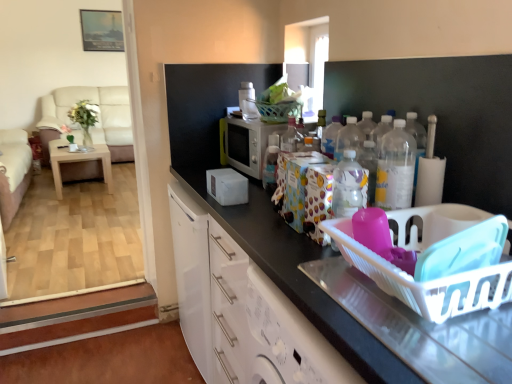
Question: Considering the relative sizes of beige fabric couch at left, the second couch positioned from the front, and white plastic basket at right in the image provided, is beige fabric couch at left, the second couch positioned from the front, shorter than white plastic basket at right?

Choices:
 (A) yes
 (B) no

Answer: (B)

Question: From a real-world perspective, does beige fabric couch at left, arranged as the first couch when viewed from the back, sit lower than white plastic basket at right?

Choices:
 (A) no
 (B) yes

Answer: (B)

Question: Are beige fabric couch at left, arranged as the first couch when viewed from the back, and white plastic basket at right located far from each other?

Choices:
 (A) no
 (B) yes

Answer: (B)

Question: Is beige fabric couch at left, the second couch positioned from the front, smaller than white plastic basket at right?

Choices:
 (A) yes
 (B) no

Answer: (B)

Question: From a real-world perspective, is beige fabric couch at left, arranged as the first couch when viewed from the back, on white plastic basket at right?

Choices:
 (A) yes
 (B) no

Answer: (B)

Question: Is the position of beige fabric couch at left, arranged as the first couch when viewed from the back, more distant than that of white plastic basket at right?

Choices:
 (A) no
 (B) yes

Answer: (B)

Question: From a real-world perspective, is beige fabric couch at left, the second couch positioned from the front, below clear plastic bottles at center-right?

Choices:
 (A) no
 (B) yes

Answer: (B)

Question: Are beige fabric couch at left, arranged as the first couch when viewed from the back, and clear plastic bottles at center-right located far from each other?

Choices:
 (A) no
 (B) yes

Answer: (B)

Question: Does beige fabric couch at left, the second couch positioned from the front, have a greater width compared to clear plastic bottles at center-right?

Choices:
 (A) no
 (B) yes

Answer: (B)

Question: Does beige fabric couch at left, arranged as the first couch when viewed from the back, come in front of clear plastic bottles at center-right?

Choices:
 (A) yes
 (B) no

Answer: (B)

Question: Can you confirm if beige fabric couch at left, the second couch positioned from the front, is bigger than clear plastic bottles at center-right?

Choices:
 (A) no
 (B) yes

Answer: (B)

Question: Is beige fabric couch at left, arranged as the first couch when viewed from the back, not inside clear plastic bottles at center-right?

Choices:
 (A) no
 (B) yes

Answer: (B)

Question: Is clear plastic bottles at center-right far from light brown wooden table at left?

Choices:
 (A) no
 (B) yes

Answer: (B)